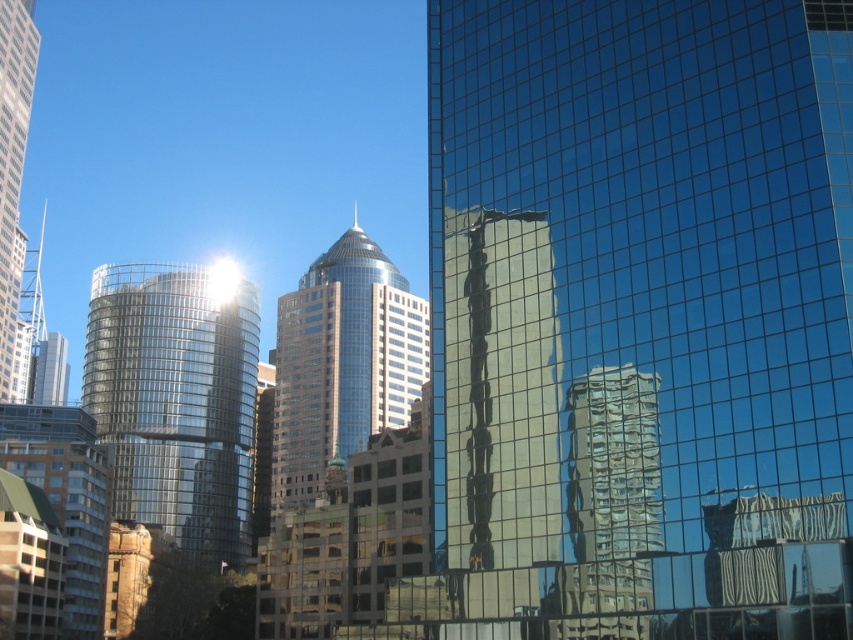
You are a delivery drone that needs to fly between the shiny glass tower at center and the shiny glass skyscraper at center. What is the minimum distance you must maintain between them to avoid collision?

The shiny glass tower at center and shiny glass skyscraper at center are 63.15 feet apart. The minimum distance you must maintain between them to avoid collision is 63.15 feet.

You are an architect analyzing the urban skyline. You observe the shiny glass tower at center and the matte glass skyscraper at left. Which of these two buildings is shorter?

The shiny glass tower at center is shorter than the matte glass skyscraper at left.